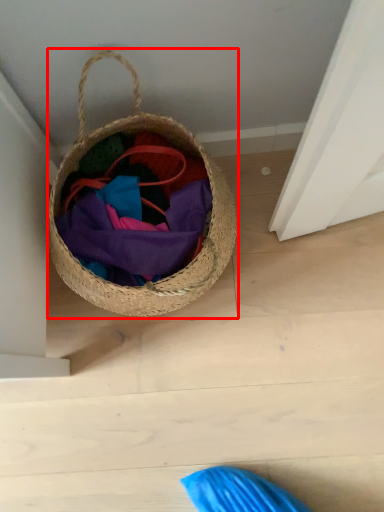
Question: From the image's perspective, what is the correct spatial positioning of picnic basket (annotated by the red box) in reference to bag?

Choices:
 (A) above
 (B) below

Answer: (A)